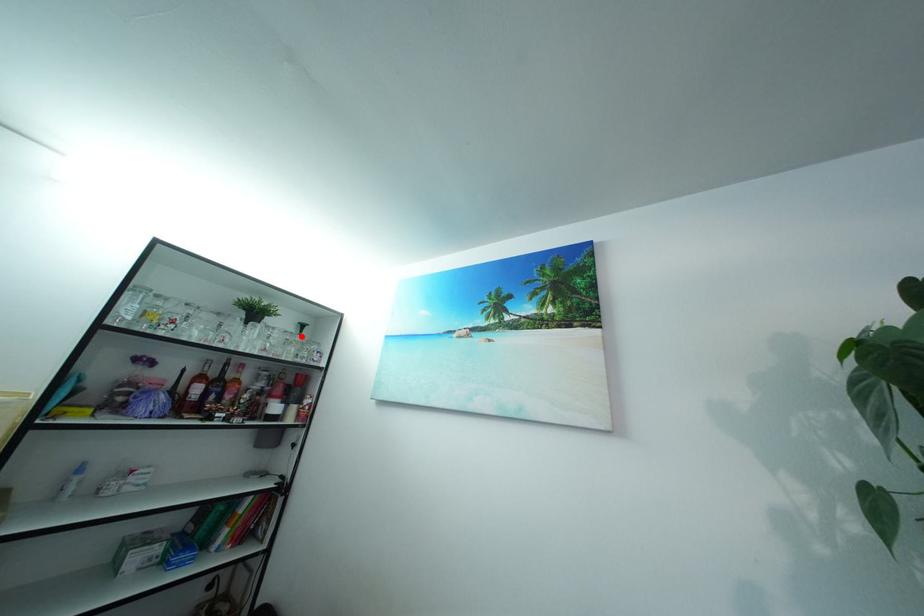
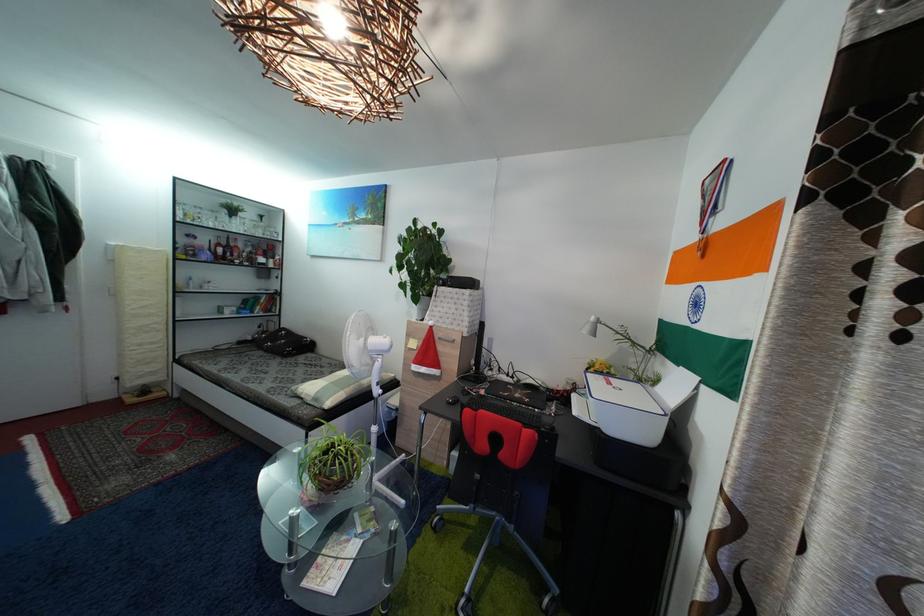
Locate, in the second image, the point that corresponds to the highlighted location in the first image.

(264, 225)